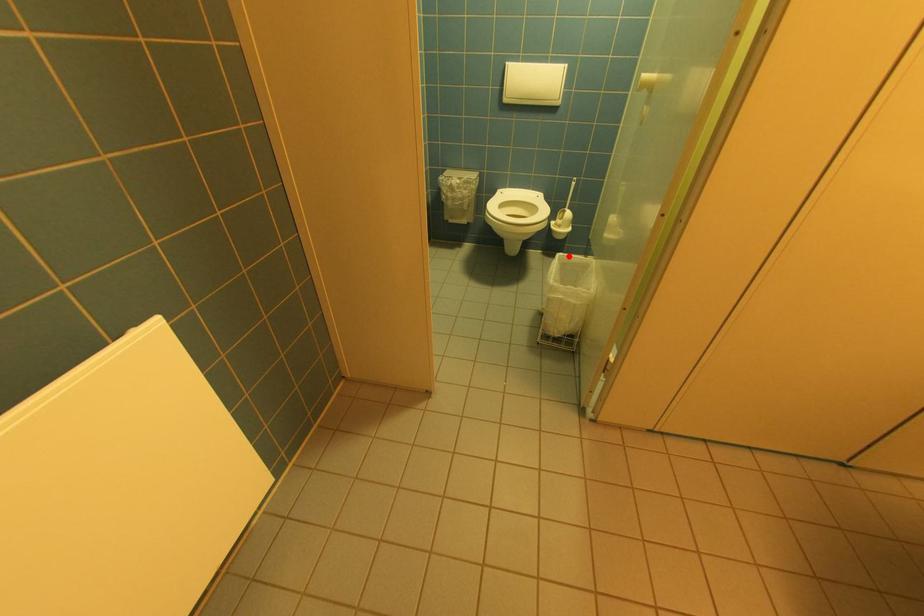
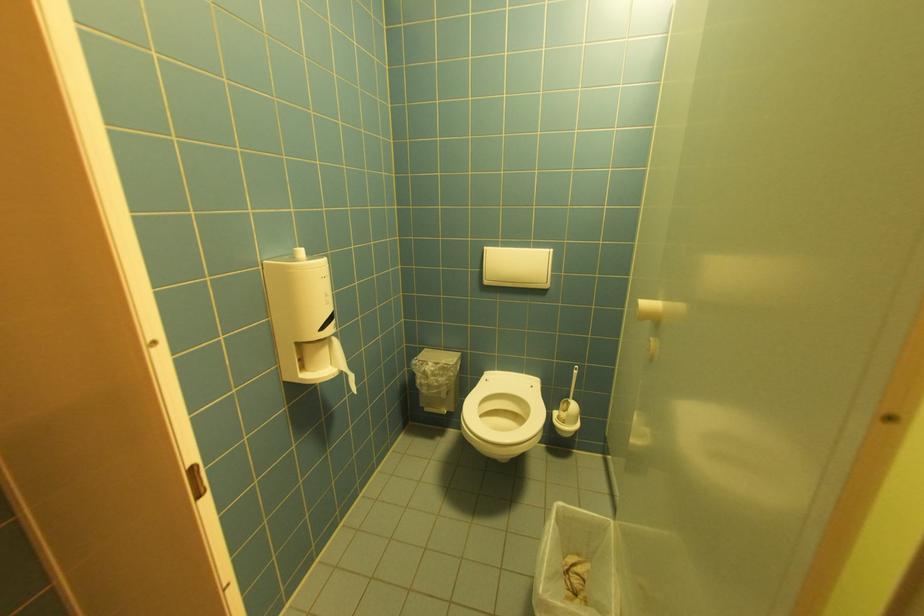
Question: I am providing you with two images of the same scene from different viewpoints. A red point is shown in image1. For the corresponding object point in image2, is it positioned nearer or farther from the camera?

Choices:
 (A) Nearer
 (B) Farther

Answer: (B)